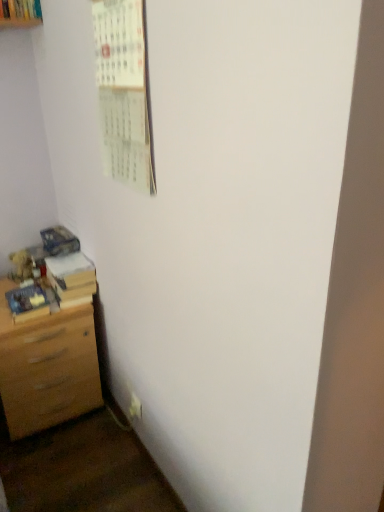
Question: From a real-world perspective, is white paper calendar at upper left positioned above or below white plastic electric outlet at lower left?

Choices:
 (A) above
 (B) below

Answer: (A)

Question: Is white paper calendar at upper left in front of or behind white plastic electric outlet at lower left in the image?

Choices:
 (A) front
 (B) behind

Answer: (A)

Question: Considering the real-world distances, which object is closest to the light brown wood chest of drawers at lower left?

Choices:
 (A) wooden book at lower left, the second book viewed from the front
 (B) white paper calendar at upper left
 (C) white plastic electric outlet at lower left
 (D) matte blue book at lower left, positioned as the second book in back-to-front order

Answer: (D)

Question: Based on their relative distances, which object is nearer to the white paper calendar at upper left?

Choices:
 (A) wooden book at lower left, the second book viewed from the front
 (B) white plastic electric outlet at lower left
 (C) light brown wood chest of drawers at lower left
 (D) matte blue book at lower left, which appears as the first book when viewed from the front

Answer: (A)